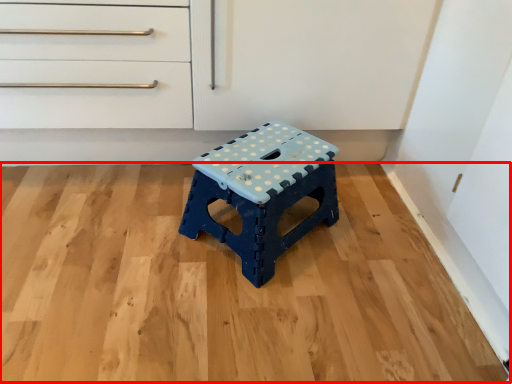
Question: From the image's perspective, considering the relative positions of hardwood (annotated by the red box) and stool in the image provided, where is hardwood (annotated by the red box) located with respect to the staircase?

Choices:
 (A) above
 (B) below

Answer: (B)